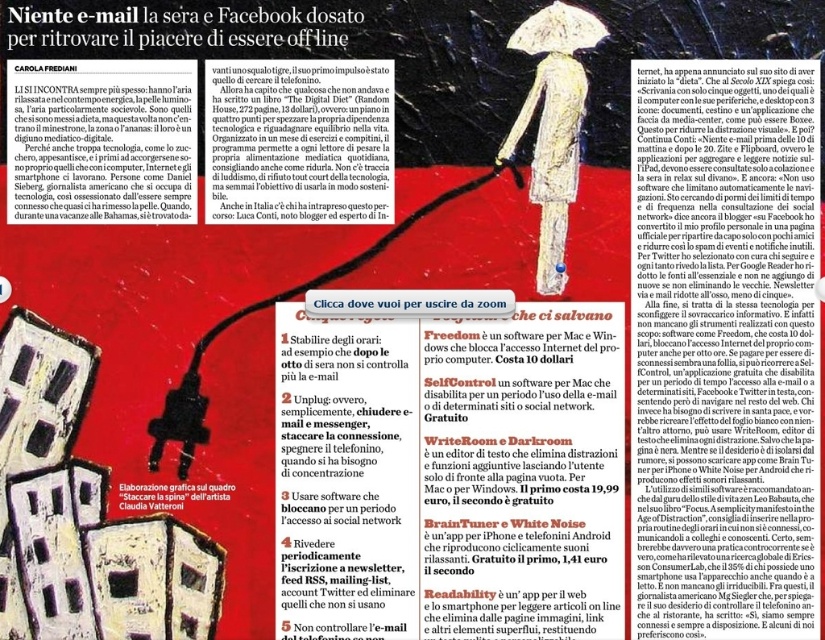
Question: Which point appears farthest from the camera in this image?

Choices:
 (A) (526, 36)
 (B) (500, 570)
 (C) (596, 24)

Answer: (B)

Question: Is yellowish pastel figure at upper right further to the viewer compared to white matte umbrella at upper center?

Choices:
 (A) no
 (B) yes

Answer: (B)

Question: Is black paper text at upper right above white matte umbrella at upper center?

Choices:
 (A) no
 (B) yes

Answer: (A)

Question: Can you confirm if black paper text at upper center is bigger than black paper at upper center?

Choices:
 (A) no
 (B) yes

Answer: (A)

Question: Which of the following is the closest to the observer?

Choices:
 (A) white paper text at center
 (B) white matte umbrella at upper center

Answer: (B)

Question: Which object is farther from the camera taking this photo?

Choices:
 (A) black paper text at upper center
 (B) white paper list at center
 (C) white paper text at center
 (D) yellowish pastel figure at upper right

Answer: (B)